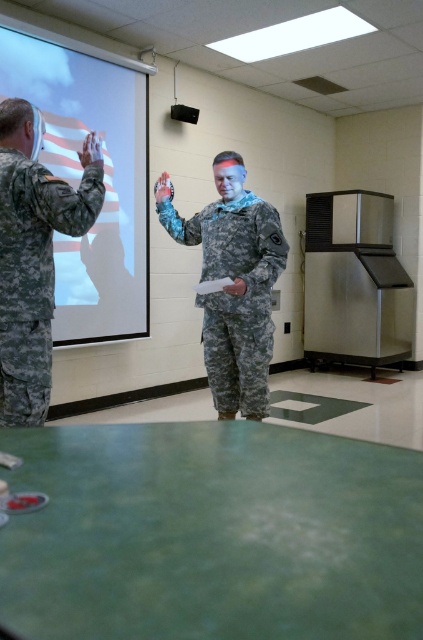
Looking at this image, can you confirm if white matte projection screen at upper left is wider than camouflage fabric uniform at center?

Yes, white matte projection screen at upper left is wider than camouflage fabric uniform at center.

Does point (68, 179) come behind point (263, 321)?

Yes, it is.

Locate an element on the screen. white matte projection screen at upper left is located at coordinates (80, 173).

The width and height of the screenshot is (423, 640). What do you see at coordinates (33, 275) in the screenshot? I see `camouflage fabric uniform at left` at bounding box center [33, 275].

Locate an element on the screen. camouflage fabric uniform at left is located at coordinates (33, 275).

Between point (0, 256) and point (213, 264), which one is positioned behind?

The point (213, 264) is more distant.

Identify the location of camouflage fabric uniform at left. (33, 275).

Measure the distance from white matte projection screen at upper left to camouflage fabric uniform at left.

white matte projection screen at upper left is 1.84 meters away from camouflage fabric uniform at left.

Does point (117, 147) come farther from viewer compared to point (10, 321)?

Yes, point (117, 147) is farther from viewer.

What do you see at coordinates (80, 173) in the screenshot? I see `white matte projection screen at upper left` at bounding box center [80, 173].

Where is `white matte projection screen at upper left`? The image size is (423, 640). white matte projection screen at upper left is located at coordinates (80, 173).